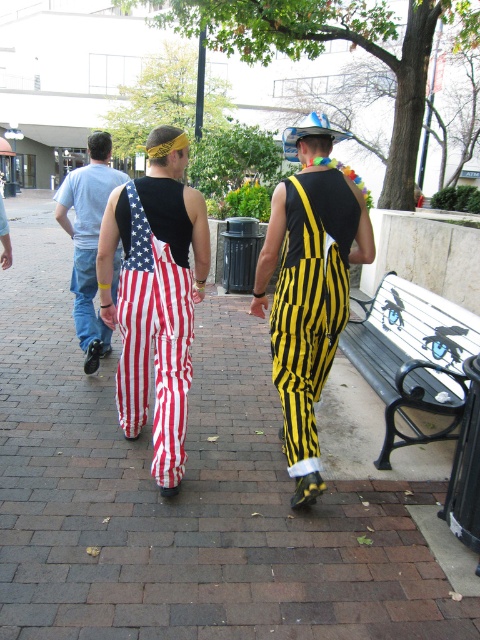
Question: Can you confirm if red brick pavement at center is wider than metallic silver bench at right?

Choices:
 (A) yes
 (B) no

Answer: (A)

Question: Among these objects, which one is nearest to the camera?

Choices:
 (A) metallic silver bench at right
 (B) yellow striped overalls at center
 (C) american flag pants at left

Answer: (A)

Question: Does american flag overalls at center have a smaller size compared to yellow striped overalls at center?

Choices:
 (A) yes
 (B) no

Answer: (A)

Question: Which is nearer to the american flag overalls at center?

Choices:
 (A) yellow striped overalls at center
 (B) red brick pavement at center
 (C) metallic silver bench at right
 (D) american flag pants at left

Answer: (A)

Question: Can you confirm if red brick pavement at center is positioned above american flag overalls at center?

Choices:
 (A) yes
 (B) no

Answer: (B)

Question: Which point is farther from the camera taking this photo?

Choices:
 (A) (107, 337)
 (B) (365, 339)
 (C) (158, 392)
 (D) (307, 448)

Answer: (A)